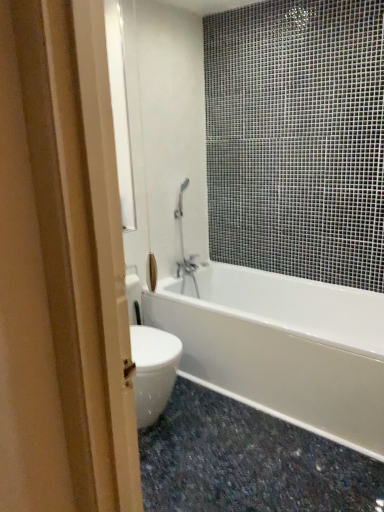
Question: Is white glossy bathtub at center completely or partially inside granite at lower right?

Choices:
 (A) yes
 (B) no

Answer: (B)

Question: Considering the relative positions of granite at lower right and white glossy bathtub at center in the image provided, is granite at lower right behind white glossy bathtub at center?

Choices:
 (A) yes
 (B) no

Answer: (B)

Question: From a real-world perspective, does granite at lower right stand above white glossy bathtub at center?

Choices:
 (A) yes
 (B) no

Answer: (B)

Question: Can you confirm if granite at lower right is positioned to the left of white glossy bathtub at center?

Choices:
 (A) no
 (B) yes

Answer: (B)

Question: Is granite at lower right outside of white glossy bathtub at center?

Choices:
 (A) no
 (B) yes

Answer: (B)

Question: Considering the relative sizes of granite at lower right and white glossy bathtub at center in the image provided, is granite at lower right smaller than white glossy bathtub at center?

Choices:
 (A) no
 (B) yes

Answer: (B)

Question: Is white glossy bathtub at center outside granite at lower right?

Choices:
 (A) no
 (B) yes

Answer: (B)

Question: Is white glossy bathtub at center closer to the viewer compared to granite at lower right?

Choices:
 (A) yes
 (B) no

Answer: (B)

Question: Is white glossy bathtub at center further to camera compared to granite at lower right?

Choices:
 (A) yes
 (B) no

Answer: (A)

Question: Does white glossy bathtub at center have a greater width compared to granite at lower right?

Choices:
 (A) yes
 (B) no

Answer: (B)

Question: Considering the relative sizes of white glossy bathtub at center and granite at lower right in the image provided, is white glossy bathtub at center taller than granite at lower right?

Choices:
 (A) no
 (B) yes

Answer: (B)

Question: Is white glossy bathtub at center not near granite at lower right?

Choices:
 (A) yes
 (B) no

Answer: (B)

Question: Which is correct: granite at lower right is inside white glossy bathtub at center, or outside of it?

Choices:
 (A) inside
 (B) outside

Answer: (B)